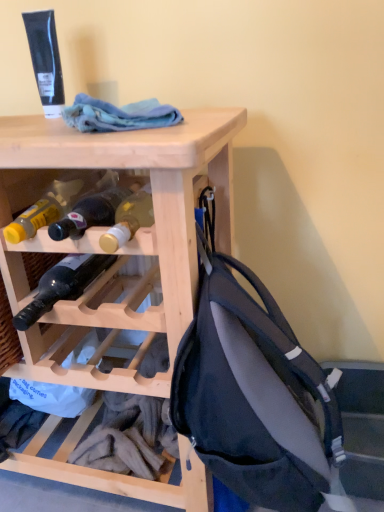
Question: From a real-world perspective, is matte glass bottle at center, acting as the second bottle starting from the bottom, under blue cotton cloth at upper center?

Choices:
 (A) no
 (B) yes

Answer: (B)

Question: Does matte glass bottle at center, acting as the second bottle starting from the bottom, appear on the left side of blue cotton cloth at upper center?

Choices:
 (A) no
 (B) yes

Answer: (B)

Question: Can you confirm if matte glass bottle at center, acting as the second bottle starting from the bottom, is bigger than blue cotton cloth at upper center?

Choices:
 (A) no
 (B) yes

Answer: (A)

Question: Can you confirm if matte glass bottle at center, acting as the second bottle starting from the bottom, is shorter than blue cotton cloth at upper center?

Choices:
 (A) no
 (B) yes

Answer: (B)

Question: Does matte glass bottle at center, the 1th bottle viewed from the top, contain blue cotton cloth at upper center?

Choices:
 (A) no
 (B) yes

Answer: (A)

Question: From the image's perspective, relative to natural wood wine rack at upper center, is blue cotton cloth at upper center above or below?

Choices:
 (A) above
 (B) below

Answer: (A)

Question: Based on their sizes in the image, would you say blue cotton cloth at upper center is bigger or smaller than natural wood wine rack at upper center?

Choices:
 (A) big
 (B) small

Answer: (B)

Question: Considering the positions of blue cotton cloth at upper center and natural wood wine rack at upper center in the image, is blue cotton cloth at upper center taller or shorter than natural wood wine rack at upper center?

Choices:
 (A) short
 (B) tall

Answer: (A)

Question: Considering the positions of point (107, 130) and point (89, 292), is point (107, 130) closer or farther from the camera than point (89, 292)?

Choices:
 (A) closer
 (B) farther

Answer: (A)

Question: In the image, is dark glass bottle at center, acting as the 1th bottle starting from the bottom, on the left side or the right side of blue cotton cloth at upper center?

Choices:
 (A) left
 (B) right

Answer: (A)

Question: Considering their positions, is dark glass bottle at center, acting as the 1th bottle starting from the bottom, located in front of or behind blue cotton cloth at upper center?

Choices:
 (A) behind
 (B) front

Answer: (A)

Question: Is dark glass bottle at center, arranged as the 2th bottle when viewed from the top, spatially inside blue cotton cloth at upper center, or outside of it?

Choices:
 (A) inside
 (B) outside

Answer: (B)

Question: From the image's perspective, is dark glass bottle at center, arranged as the 2th bottle when viewed from the top, above or below blue cotton cloth at upper center?

Choices:
 (A) above
 (B) below

Answer: (B)

Question: From a real-world perspective, relative to matte black backpack at right, is matte glass bottle at center, acting as the second bottle starting from the bottom, vertically above or below?

Choices:
 (A) below
 (B) above

Answer: (B)

Question: In terms of size, does matte glass bottle at center, acting as the second bottle starting from the bottom, appear bigger or smaller than matte black backpack at right?

Choices:
 (A) small
 (B) big

Answer: (A)